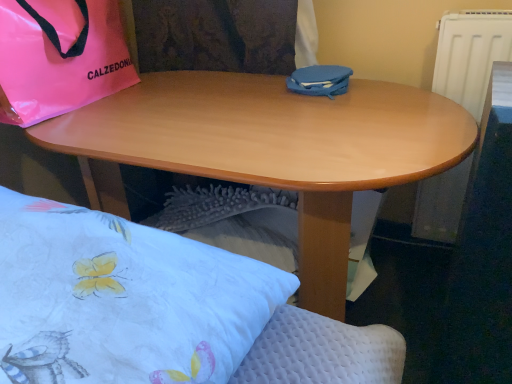
Question: From a real-world perspective, is wooden desk at center above or below pink glossy bag at upper left?

Choices:
 (A) above
 (B) below

Answer: (B)

Question: From the image's perspective, is wooden desk at center located above or below pink glossy bag at upper left?

Choices:
 (A) below
 (B) above

Answer: (A)

Question: Based on their relative distances, which object is nearer to the wooden desk at center?

Choices:
 (A) pink glossy bag at upper left
 (B) blue matte case at center
 (C) white quilted pillow at lower left

Answer: (B)

Question: Based on their relative distances, which object is nearer to the wooden desk at center?

Choices:
 (A) white quilted pillow at lower left
 (B) pink glossy bag at upper left
 (C) blue matte case at center

Answer: (C)